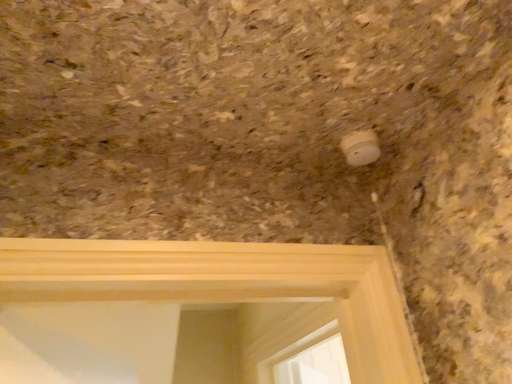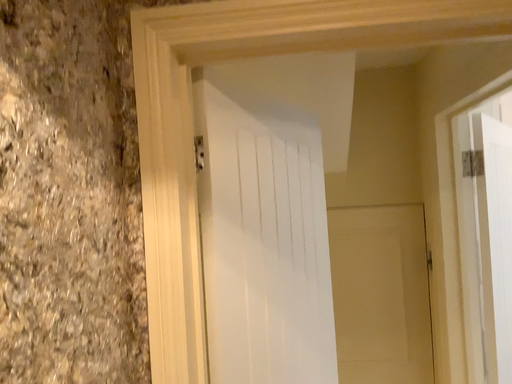
Question: How did the camera likely rotate when shooting the video?

Choices:
 (A) rotated upward
 (B) rotated downward

Answer: (B)